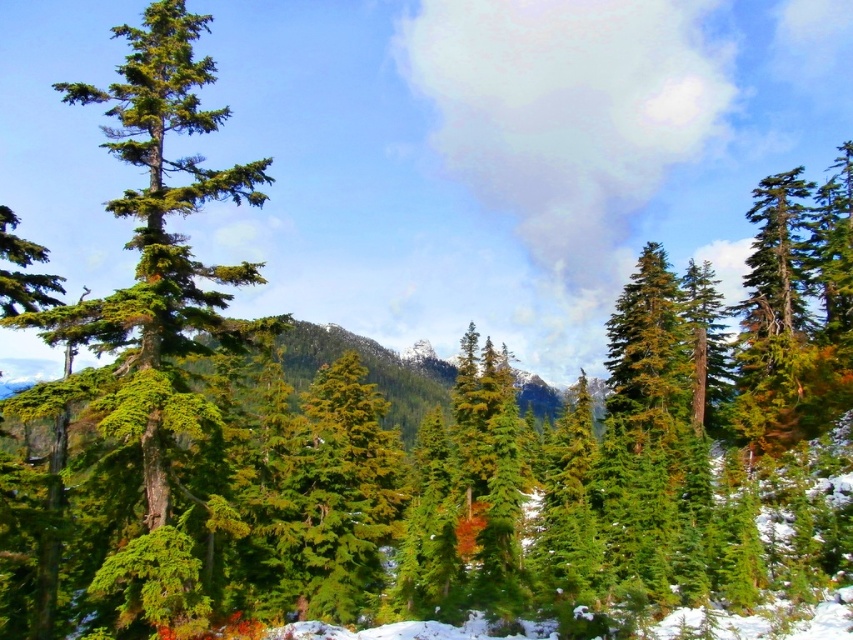
Is green textured evergreen tree at left taller than green matte tree at center?

Yes.

Is green textured evergreen tree at left smaller than green matte tree at center?

No, green textured evergreen tree at left is not smaller than green matte tree at center.

This screenshot has height=640, width=853. What are the coordinates of `green textured evergreen tree at left` in the screenshot? It's located at (167, 188).